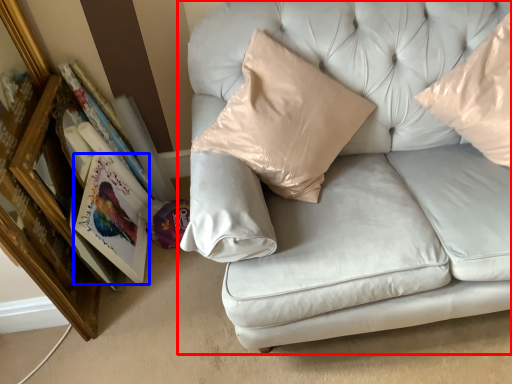
Question: Among these objects, which one is farthest to the camera, studio couch (highlighted by a red box) or paperback book (highlighted by a blue box)?

Choices:
 (A) studio couch
 (B) paperback book

Answer: (B)